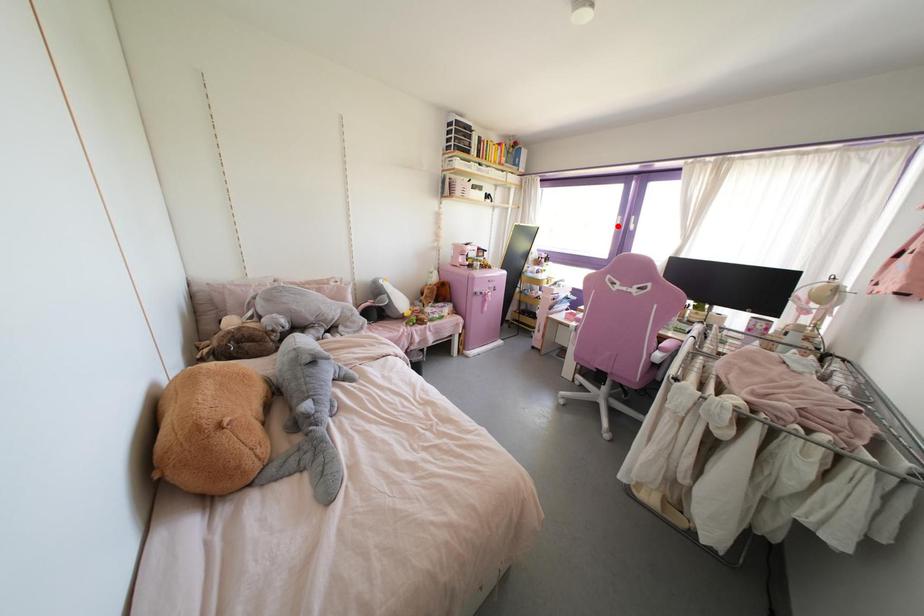
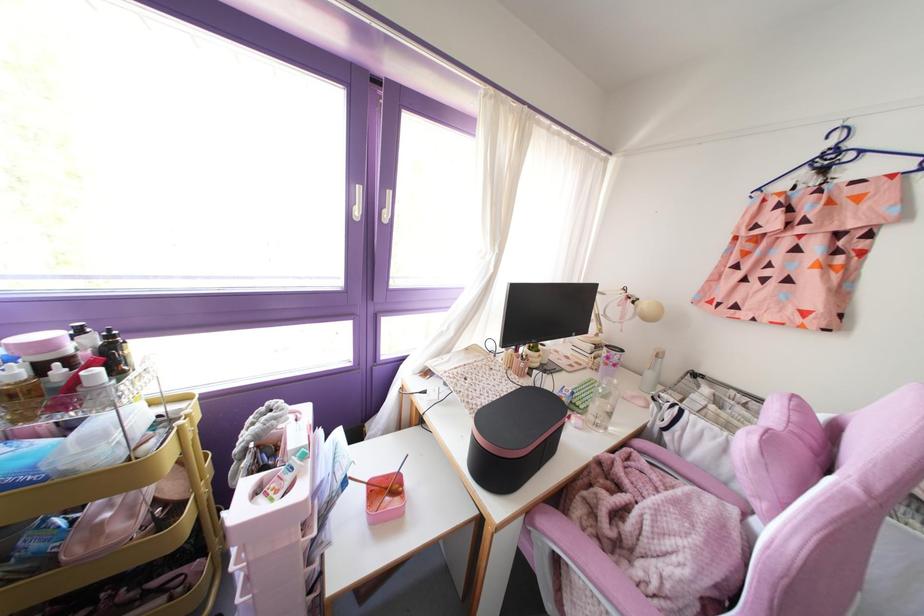
Where in the second image is the point corresponding to the highlighted location from the first image?

(357, 212)